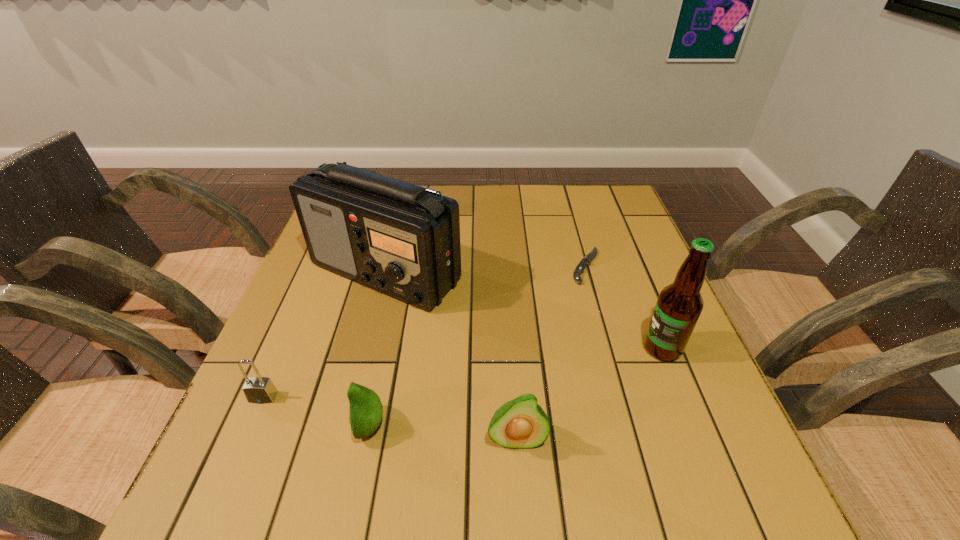
I want to click on the shorter avocado, so click(x=365, y=408).

Where is `the third object from right to left`? The height and width of the screenshot is (540, 960). the third object from right to left is located at coordinates (521, 423).

This screenshot has width=960, height=540. Find the location of `the third tallest object`. the third tallest object is located at coordinates (521, 423).

Locate an element on the screen. The image size is (960, 540). the rightmost object is located at coordinates (679, 305).

I want to click on beer bottle, so click(x=679, y=305).

Where is `radio receiver`? radio receiver is located at coordinates (401, 239).

Image resolution: width=960 pixels, height=540 pixels. What are the coordinates of `the second object from right to left` in the screenshot? It's located at (587, 259).

Where is `the shortest object`? This screenshot has width=960, height=540. the shortest object is located at coordinates (587, 259).

Identify the location of the fourth farthest object. (260, 390).

Identify the location of free spot located on the cut side of the left avocado. This screenshot has height=540, width=960. (283, 426).